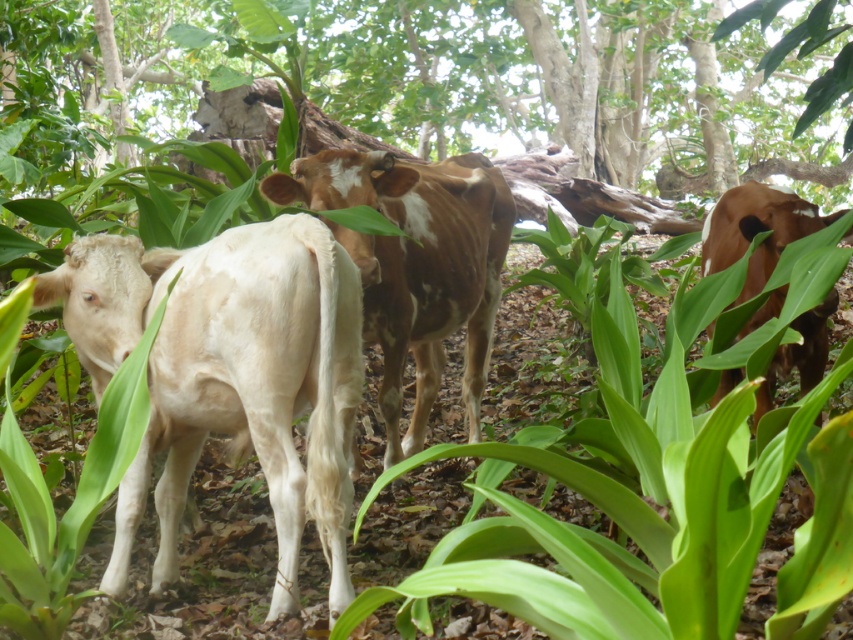
Is point (91, 264) in front of point (770, 376)?

Yes, it is in front of point (770, 376).

Can you confirm if white smooth cow at left is smaller than brown glossy cow at right?

Yes, white smooth cow at left is smaller than brown glossy cow at right.

This screenshot has width=853, height=640. What are the coordinates of `white smooth cow at left` in the screenshot? It's located at (229, 376).

Is the position of brown speckled hide at center more distant than that of brown glossy cow at right?

Yes, it is.

Can you confirm if brown speckled hide at center is wider than brown glossy cow at right?

Yes.

Locate an element on the screen. This screenshot has width=853, height=640. brown speckled hide at center is located at coordinates (416, 266).

You are a GUI agent. You are given a task and a screenshot of the screen. Output one action in this format:
    pyautogui.click(x=<x>, y=<y>)
    Task: Click on the brown speckled hide at center
    
    Given the screenshot: What is the action you would take?
    pyautogui.click(x=416, y=266)

Does white smooth cow at left appear on the left side of brown speckled hide at center?

Yes, white smooth cow at left is to the left of brown speckled hide at center.

Is the position of white smooth cow at left less distant than that of brown speckled hide at center?

Yes, it is in front of brown speckled hide at center.

At what (x,y) coordinates should I click in order to perform the action: click on white smooth cow at left. Please return your answer as a coordinate pair (x, y). The image size is (853, 640). Looking at the image, I should click on (229, 376).